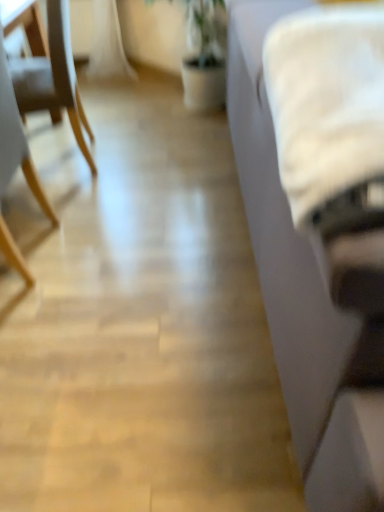
Where is `unoccupied space behind light wood chair at left, which is the second chair from front to back`? The image size is (384, 512). unoccupied space behind light wood chair at left, which is the second chair from front to back is located at coordinates (104, 122).